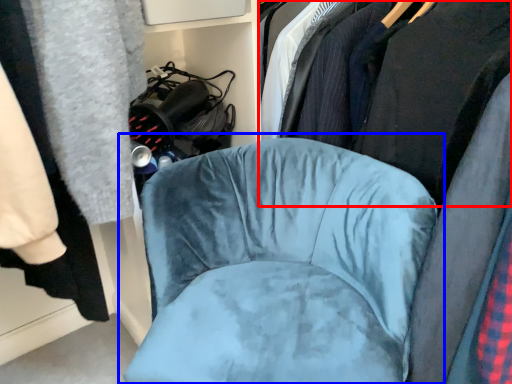
Question: Among these objects, which one is farthest to the camera, clothing (highlighted by a red box) or chair (highlighted by a blue box)?

Choices:
 (A) clothing
 (B) chair

Answer: (A)